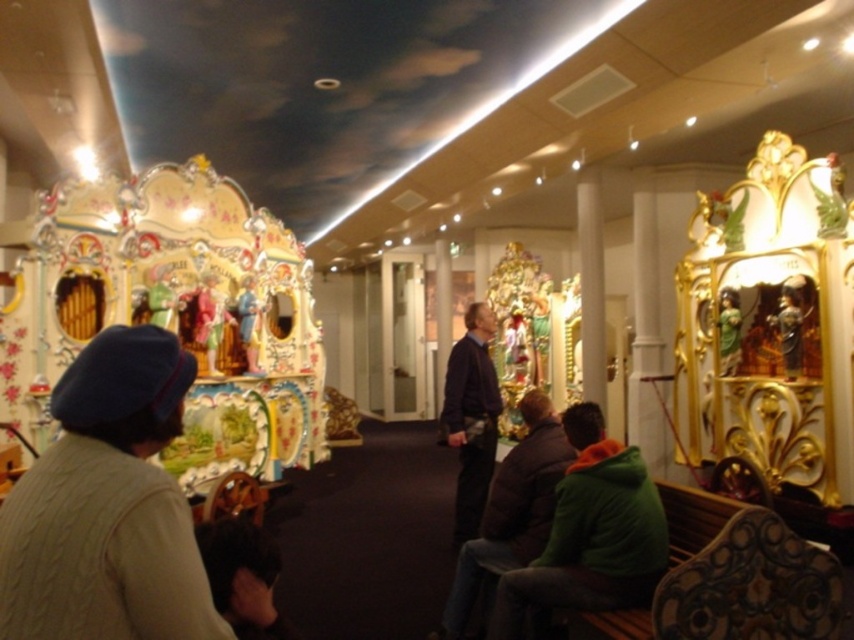
Question: Can you confirm if green fleece jacket at lower center is positioned above dark blue sweater at center?

Choices:
 (A) yes
 (B) no

Answer: (B)

Question: Estimate the real-world distances between objects in this image. Which object is farther from the green fleece jacket at lower center?

Choices:
 (A) cable-knit sweater at lower left
 (B) dark brown leather jacket at center

Answer: (A)

Question: Considering the real-world distances, which object is farthest from the dark brown leather jacket at center?

Choices:
 (A) cable-knit sweater at lower left
 (B) green fleece jacket at lower center
 (C) dark blue sweater at center

Answer: (A)

Question: From the image, what is the correct spatial relationship of green fleece jacket at lower center in relation to dark brown leather jacket at center?

Choices:
 (A) right
 (B) left

Answer: (A)

Question: Which point is closer to the camera?

Choices:
 (A) dark brown leather jacket at center
 (B) dark blue sweater at center

Answer: (A)

Question: Observing the image, what is the correct spatial positioning of dark brown leather jacket at center in reference to dark blue sweater at center?

Choices:
 (A) left
 (B) right

Answer: (B)